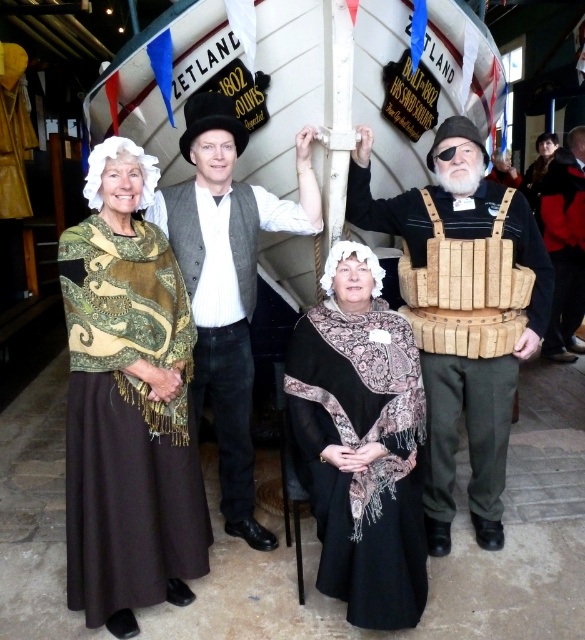
You are a photographer at the exhibition and want to capture a photo of the green patterned shawl at center and the red leather jacket at lower right. Based on their positions, which object is closer to the left side of the photo?

The green patterned shawl at center is closer to the left side of the photo because it is positioned to the left of the red leather jacket at lower right.

You are standing in front of the Zetland ship model and notice two points marked on the floor. The first point is at coordinate point (x=473, y=177) and the second at point (x=576, y=131). If you want to step closer to the ship model, which point should you move towards?

You should move towards point (x=473, y=177) because it is closer to the viewer than point (x=576, y=131), so stepping towards it would bring you nearer to the ship model.

You are a security guard in the museum and need to inspect the wooden crates at center and the red leather jacket at lower right. Which object should you check first if you want to start from the lowest position?

You should check the wooden crates at center first because it is located below the red leather jacket at lower right, making it the lower object.